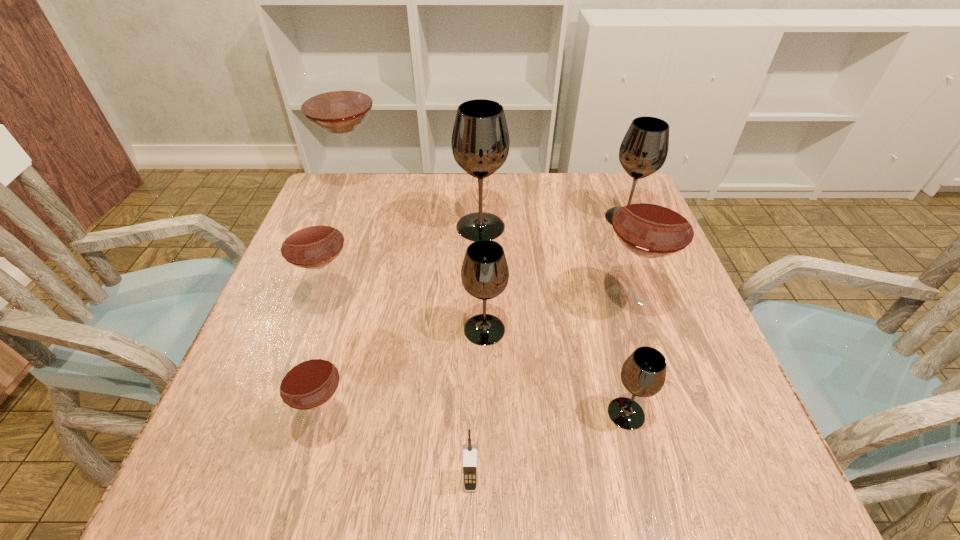
Select which gray wineglass is the third closest to the third gray wineglass from left to right. Please provide its 2D coordinates. Your answer should be formatted as a tuple, i.e. [(x, y)], where the tuple contains the x and y coordinates of a point satisfying the conditions above.

[(644, 148)]

The image size is (960, 540). I want to click on the closest gray wineglass relative to the third smallest red wineglass, so click(x=643, y=373).

Where is `blank area in the image that satisfies the following two spatial constraints: 1. on the back side of the third biggest red wineglass; 2. on the right side of the rightmost gray wineglass`? The width and height of the screenshot is (960, 540). blank area in the image that satisfies the following two spatial constraints: 1. on the back side of the third biggest red wineglass; 2. on the right side of the rightmost gray wineglass is located at coordinates (360, 218).

This screenshot has height=540, width=960. Find the location of `vacant space that satisfies the following two spatial constraints: 1. on the back side of the rightmost gray wineglass; 2. on the left side of the nearest gray wineglass`. vacant space that satisfies the following two spatial constraints: 1. on the back side of the rightmost gray wineglass; 2. on the left side of the nearest gray wineglass is located at coordinates (575, 218).

This screenshot has width=960, height=540. What are the coordinates of `vacant space that satisfies the following two spatial constraints: 1. on the back side of the smallest gray wineglass; 2. on the left side of the nearest red wineglass` in the screenshot? It's located at (332, 413).